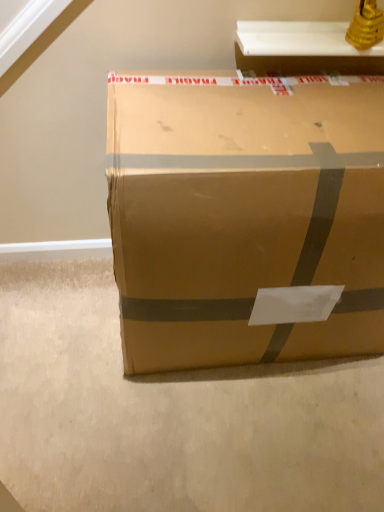
Question: Considering their positions, is brown cardboard box at center located in front of or behind white glossy shelf at upper center?

Choices:
 (A) front
 (B) behind

Answer: (A)

Question: From a real-world perspective, relative to white glossy shelf at upper center, is brown cardboard box at center vertically above or below?

Choices:
 (A) above
 (B) below

Answer: (B)

Question: Considering the positions of brown cardboard box at center and white glossy shelf at upper center in the image, is brown cardboard box at center wider or thinner than white glossy shelf at upper center?

Choices:
 (A) thin
 (B) wide

Answer: (B)

Question: From the image's perspective, is white glossy shelf at upper center above or below brown cardboard box at center?

Choices:
 (A) below
 (B) above

Answer: (B)

Question: Relative to brown cardboard box at center, is white glossy shelf at upper center in front or behind?

Choices:
 (A) front
 (B) behind

Answer: (B)

Question: Considering the positions of point (349, 69) and point (122, 122), is point (349, 69) closer or farther from the camera than point (122, 122)?

Choices:
 (A) closer
 (B) farther

Answer: (B)

Question: Considering the positions of white glossy shelf at upper center and brown cardboard box at center in the image, is white glossy shelf at upper center bigger or smaller than brown cardboard box at center?

Choices:
 (A) small
 (B) big

Answer: (A)